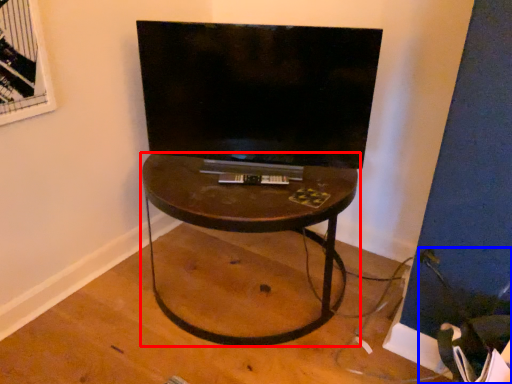
Question: Among these objects, which one is farthest to the camera, table (highlighted by a red box) or swivel chair (highlighted by a blue box)?

Choices:
 (A) table
 (B) swivel chair

Answer: (A)